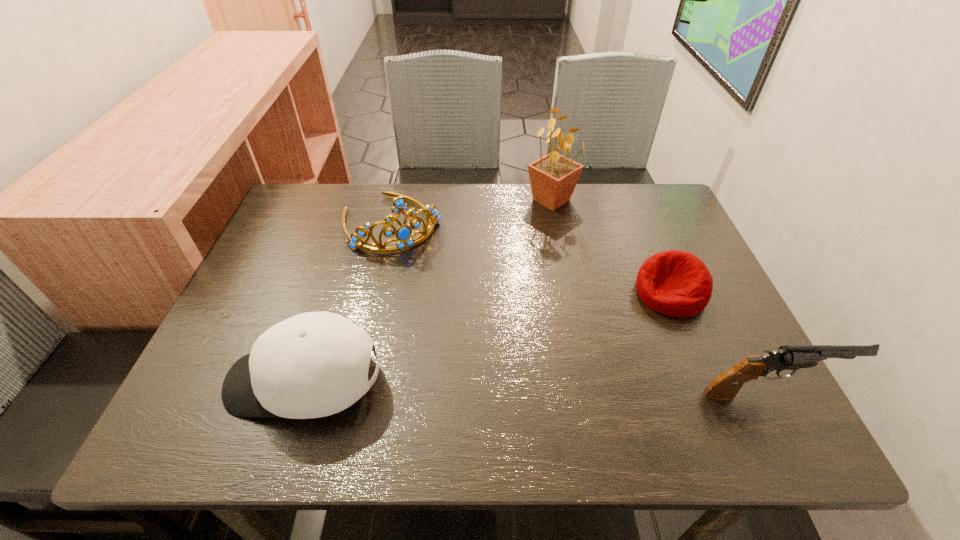
Where is `empty space between the gun and the third nearest object`? Image resolution: width=960 pixels, height=540 pixels. empty space between the gun and the third nearest object is located at coordinates (719, 343).

In order to click on free point between the gun and the beanbag in this screenshot , I will do `click(719, 343)`.

This screenshot has width=960, height=540. Identify the location of unoccupied position between the tiara and the baseball cap. (348, 302).

The image size is (960, 540). I want to click on free spot between the sunflower and the tiara, so click(471, 211).

Locate an element on the screen. This screenshot has height=540, width=960. empty space between the third object from left to right and the tiara is located at coordinates (471, 211).

Identify the location of empty space between the tiara and the shortest object. The image size is (960, 540). (531, 258).

Identify the location of vacant area that lies between the gun and the baseball cap. This screenshot has width=960, height=540. (537, 387).

Where is `empty location between the third farthest object and the tiara`? Image resolution: width=960 pixels, height=540 pixels. empty location between the third farthest object and the tiara is located at coordinates (531, 258).

Locate an element on the screen. The height and width of the screenshot is (540, 960). vacant space that is in between the baseball cap and the tallest object is located at coordinates (428, 291).

Locate which object ranks fourth in proximity to the beanbag. Please provide its 2D coordinates. Your answer should be formatted as a tuple, i.e. [(x, y)], where the tuple contains the x and y coordinates of a point satisfying the conditions above.

[(315, 364)]